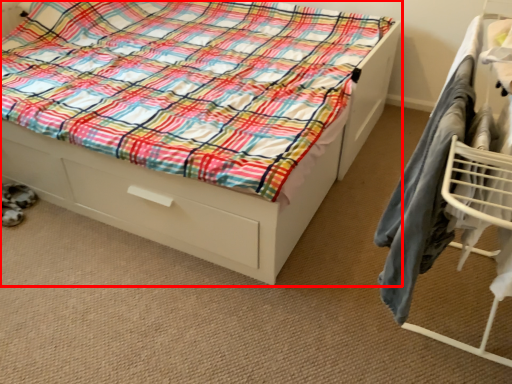
Question: From the image's perspective, where is bed (annotated by the red box) located in relation to furniture in the image?

Choices:
 (A) below
 (B) above

Answer: (B)